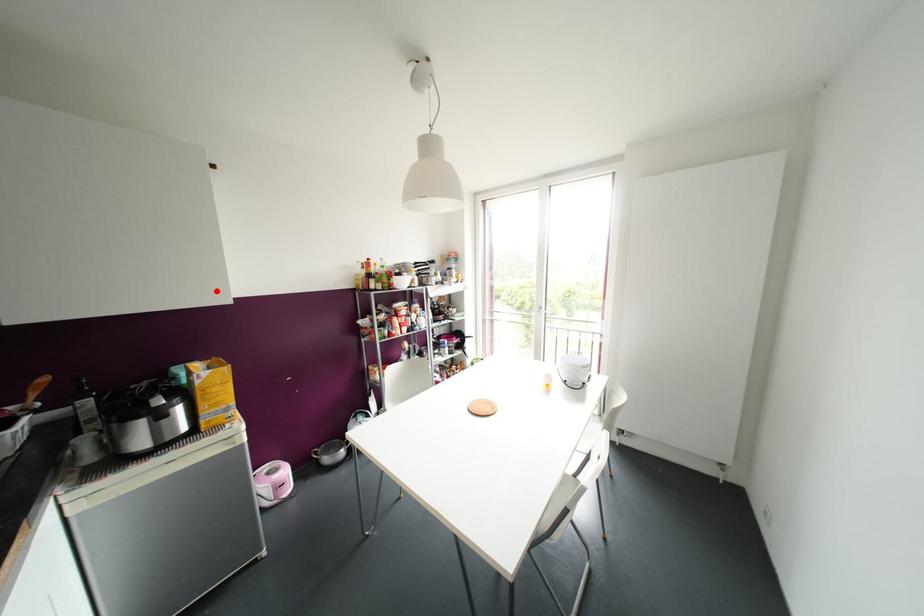
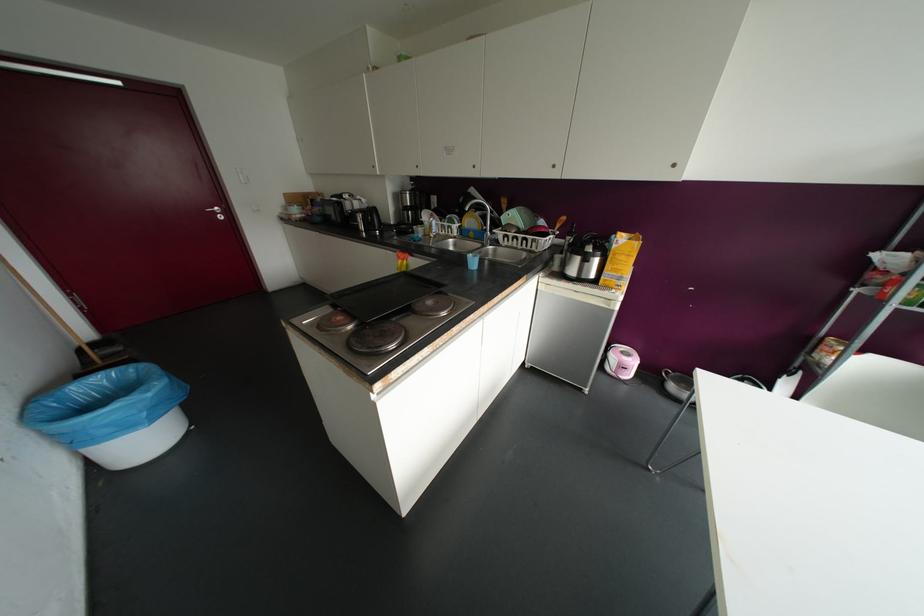
The point at the highlighted location is marked in the first image. Where is the corresponding point in the second image?

(673, 164)